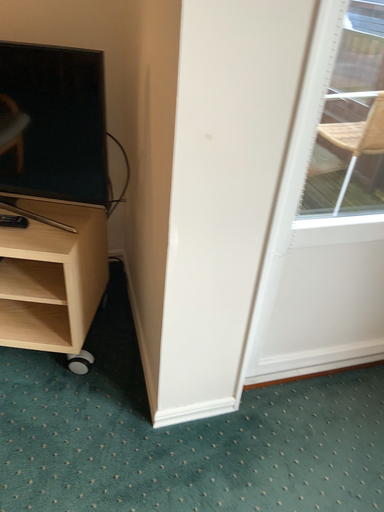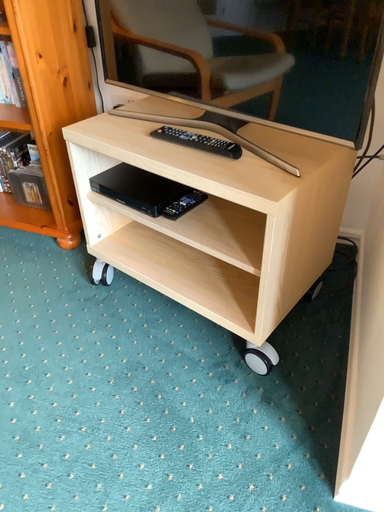
Question: How did the camera likely rotate when shooting the video?

Choices:
 (A) rotated right
 (B) rotated left

Answer: (B)